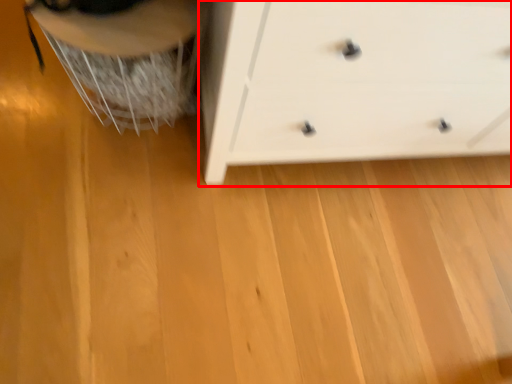
Question: Observing the image, what is the correct spatial positioning of chest of drawers (annotated by the red box) in reference to swivel chair?

Choices:
 (A) left
 (B) right

Answer: (B)